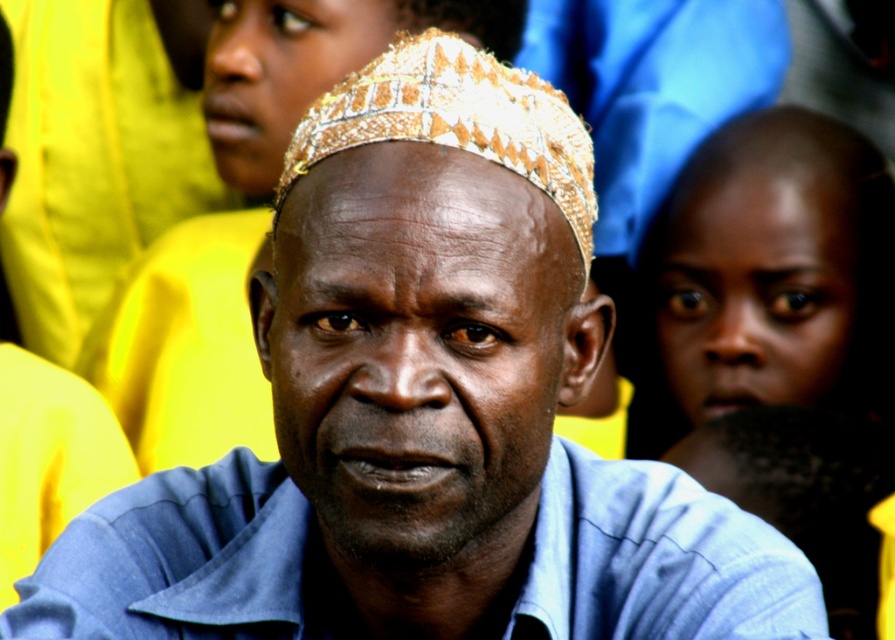
Does smooth skin head at right appear under blue fabric head at lower right?

Actually, smooth skin head at right is above blue fabric head at lower right.

Find the location of `smooth skin head at right`. smooth skin head at right is located at coordinates (776, 269).

Between beaded fabric headscarf at center and blue fabric head at lower right, which one is positioned higher?

beaded fabric headscarf at center is above.

Does beaded fabric headscarf at center have a lesser height compared to blue fabric head at lower right?

Indeed, beaded fabric headscarf at center has a lesser height compared to blue fabric head at lower right.

The image size is (895, 640). What do you see at coordinates (455, 120) in the screenshot?
I see `beaded fabric headscarf at center` at bounding box center [455, 120].

The width and height of the screenshot is (895, 640). In order to click on beaded fabric headscarf at center in this screenshot , I will do `click(455, 120)`.

Which is behind, point (492, 529) or point (797, 529)?

Point (797, 529)

Can you confirm if matte gold headwear at center is positioned below blue fabric head at lower right?

Actually, matte gold headwear at center is above blue fabric head at lower right.

Who is more forward, (535, 237) or (871, 483)?

Point (535, 237)

Find the location of a particular element. This screenshot has width=895, height=640. matte gold headwear at center is located at coordinates (428, 304).